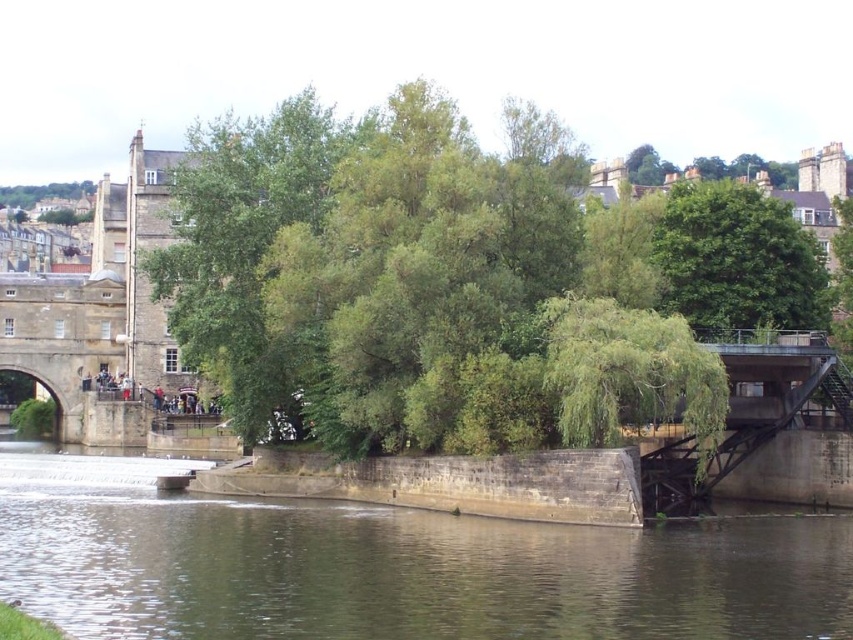
Question: Which object is positioned farthest from the concrete bridge at right?

Choices:
 (A) brown stone river at center
 (B) green leafy tree at upper left
 (C) green leafy tree at upper center
 (D) green leafy tree at center

Answer: (B)

Question: Is concrete bridge at right below green leafy tree at upper left?

Choices:
 (A) no
 (B) yes

Answer: (B)

Question: Which is nearer to the green leafy tree at upper left?

Choices:
 (A) green leafy tree at center
 (B) green leafy tree at upper center

Answer: (A)

Question: Which of the following is the closest to the observer?

Choices:
 (A) (798, 406)
 (B) (672, 301)
 (C) (787, 602)

Answer: (C)

Question: Can you confirm if green leafy tree at center is positioned to the right of green leafy tree at upper left?

Choices:
 (A) no
 (B) yes

Answer: (B)

Question: Is brown stone river at center to the left of green leafy tree at upper center from the viewer's perspective?

Choices:
 (A) no
 (B) yes

Answer: (B)